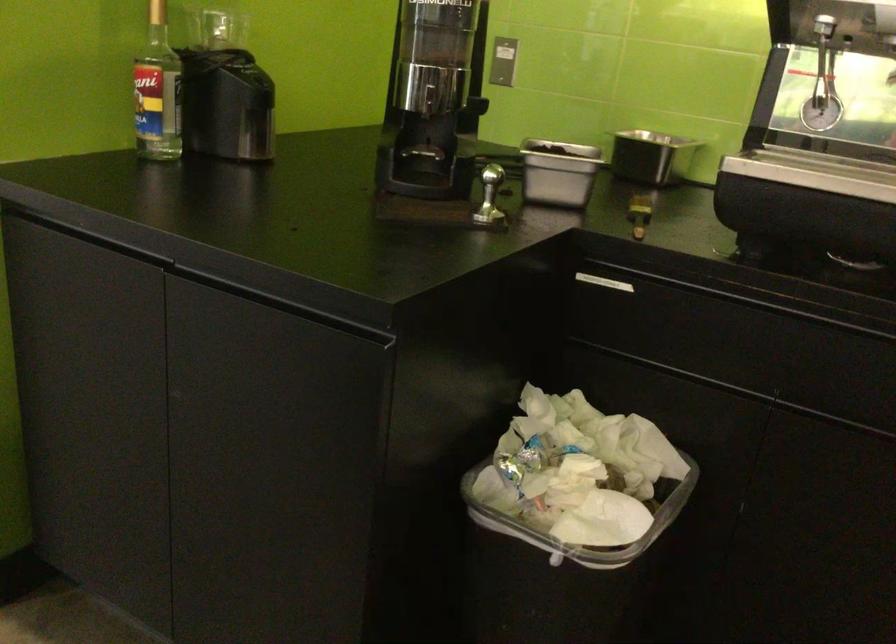
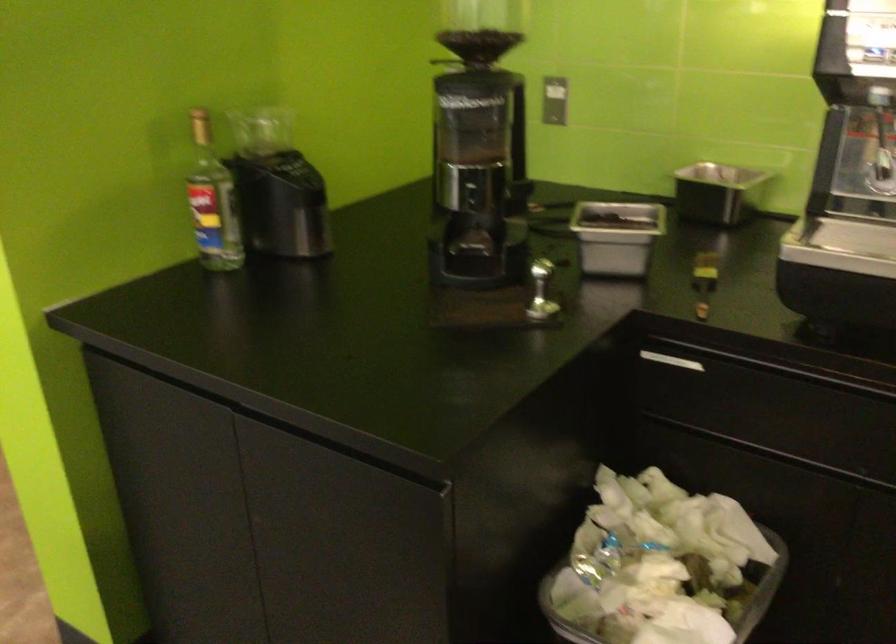
Question: In a continuous first-person perspective shot, in which direction is the camera moving?

Choices:
 (A) Left
 (B) Right
 (C) Forward
 (D) Backward

Answer: (B)